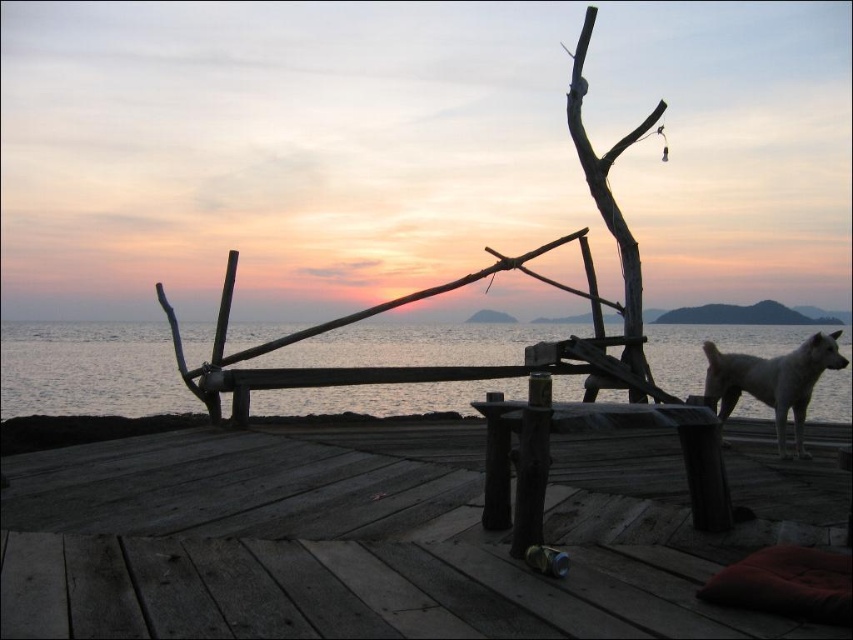
You are a painter standing at the edge of the wooden dock, and you want to place your 20 inch long painting equipment between the wooden at center and the wooden picnic table at center. Can you fit it there without overlapping either object?

The wooden at center is 20.48 inches away from the wooden picnic table at center. Since the equipment is 20 inches long, it can fit between them without overlapping either object as the distance is slightly more than the equipment length.

You are a photographer trying to capture the sunset at the wooden dock. You want to ensure the white fur dog at right is visible in the frame without blocking the wooden at center. Based on their positions, is this possible?

The wooden at center is positioned under the white fur dog at right, so the dog is above the wooden structure. This means the dog won not block the wooden at center in your photo, allowing both to be visible in the frame.